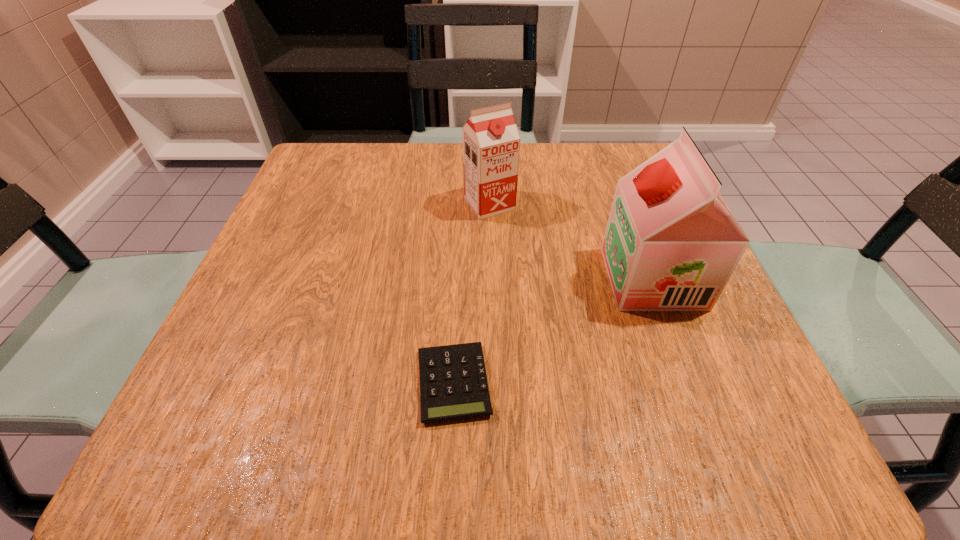
Where is `blank region between the second nearest object and the farther soya milk`? Image resolution: width=960 pixels, height=540 pixels. blank region between the second nearest object and the farther soya milk is located at coordinates (571, 241).

Locate an element on the screen. free spot between the farther soya milk and the right soya milk is located at coordinates [571, 241].

The width and height of the screenshot is (960, 540). I want to click on empty space that is in between the left soya milk and the nearest object, so click(471, 293).

Locate an element on the screen. The width and height of the screenshot is (960, 540). vacant space that's between the rightmost object and the shorter soya milk is located at coordinates (571, 241).

Locate an element on the screen. The height and width of the screenshot is (540, 960). free area in between the calculator and the nearer soya milk is located at coordinates (553, 330).

I want to click on vacant point located between the nearest object and the second nearest object, so click(x=553, y=330).

Identify the location of vacant area that lies between the second farthest object and the nearest object. This screenshot has width=960, height=540. (553, 330).

Where is `free spot between the rightmost object and the left soya milk`? free spot between the rightmost object and the left soya milk is located at coordinates (571, 241).

You are a GUI agent. You are given a task and a screenshot of the screen. Output one action in this format:
    pyautogui.click(x=<x>, y=<y>)
    Task: Click on the vacant space in between the farthest object and the right soya milk
    This screenshot has width=960, height=540.
    Given the screenshot: What is the action you would take?
    pyautogui.click(x=571, y=241)

In order to click on object that stands as the second closest to the nearest object in this screenshot , I will do `click(491, 142)`.